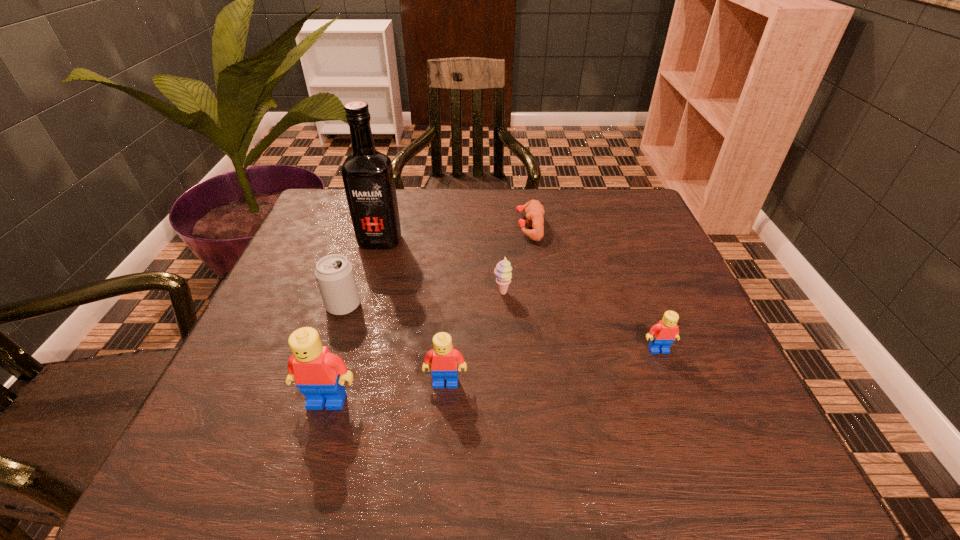
Locate an element on the screen. The image size is (960, 540). unoccupied position between the can and the leftmost Lego is located at coordinates (335, 353).

Find the location of a particular element. This screenshot has width=960, height=540. object that is the fifth closest to the second object from right to left is located at coordinates (442, 360).

Locate an element on the screen. The height and width of the screenshot is (540, 960). the fifth closest object to the shortest object is located at coordinates (442, 360).

Locate an element on the screen. The width and height of the screenshot is (960, 540). the second closest Lego to the can is located at coordinates (442, 360).

Locate an element on the screen. Lego object that ranks as the third closest to the fifth object from left to right is located at coordinates (320, 375).

I want to click on free space in the image that satisfies the following two spatial constraints: 1. with the gloves of the puncher facing forward; 2. on the front-facing side of the tallest object, so click(x=532, y=241).

At what (x,y) coordinates should I click in order to perform the action: click on vacant space that satisfies the following two spatial constraints: 1. with the gloves of the shortest object facing forward; 2. on the face of the leftmost Lego. Please return your answer as a coordinate pair (x, y). The height and width of the screenshot is (540, 960). Looking at the image, I should click on (556, 401).

Identify the location of free space that satisfies the following two spatial constraints: 1. with the gloves of the puncher facing forward; 2. on the face of the nearest Lego. The image size is (960, 540). (556, 401).